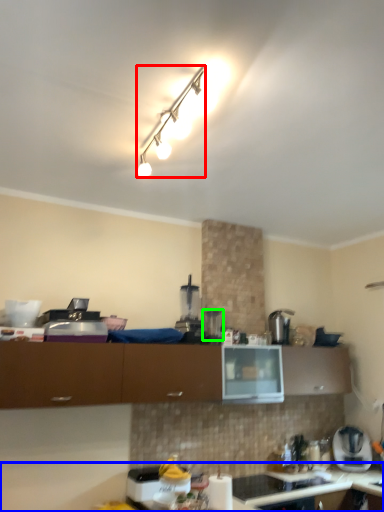
Question: Based on their relative distances, which object is nearer to lamp (highlighted by a red box)? Choose from countertop (highlighted by a blue box) and appliance (highlighted by a green box).

Choices:
 (A) countertop
 (B) appliance

Answer: (B)